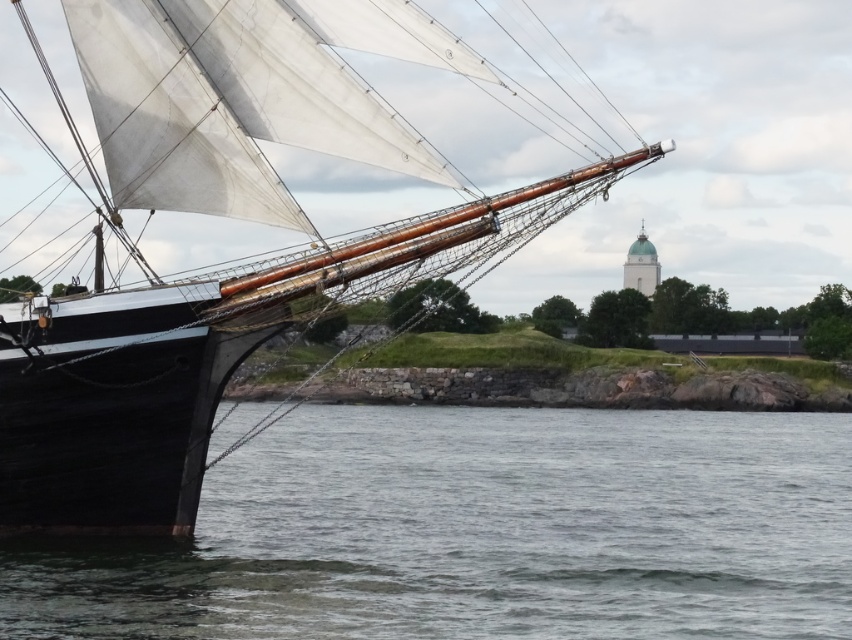
You are standing on the deck of the sailboat and looking towards the rocky shoreline. Which object would you see first when looking down from the white canvas sail at left? The clear water at lower left or the rocky shoreline?

The clear water at lower left is below the white canvas sail at left, so you would see the clear water at lower left first when looking down from the white canvas sail at left.

You are standing on the deck of the sailboat and want to retrieve a floating item located at clear water at lower left. Based on the coordinates provided, in which direction should you move relative to your current position on the boat?

You should move towards the lower left direction from your current position on the deck to reach the clear water at lower left, as it is located at coordinates point (481, 532).